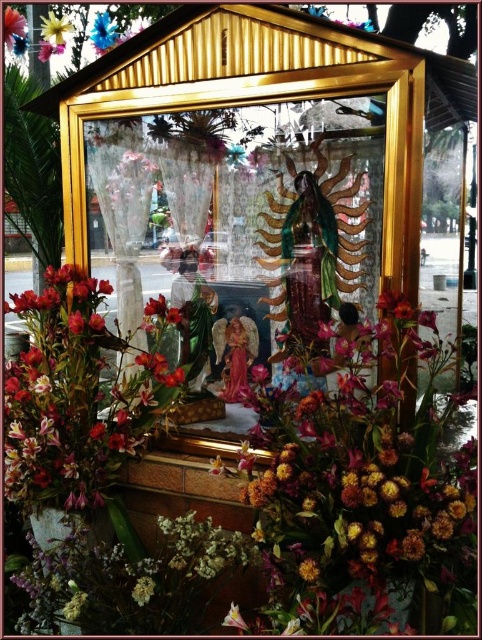
Who is lower down, yellow fabric flower at upper left or matte pink flower at upper left?

Positioned lower is matte pink flower at upper left.

Identify the location of yellow fabric flower at upper left. The image size is (482, 640). (54, 32).

The image size is (482, 640). In order to click on yellow fabric flower at upper left in this screenshot , I will do pyautogui.click(x=54, y=32).

Is point (118, 188) in front of point (116, 35)?

Yes, point (118, 188) is in front of point (116, 35).

Who is more forward, (215, 125) or (111, 35)?

Point (215, 125)

Locate an element on the screen. The image size is (482, 640). gold/glass statue at center is located at coordinates (241, 198).

You are a GUI agent. You are given a task and a screenshot of the screen. Output one action in this format:
    pyautogui.click(x=<x>, y=<y>)
    Task: Click on the gold/glass statue at center
    
    Given the screenshot: What is the action you would take?
    pyautogui.click(x=241, y=198)

Is gold/glass statue at center in front of matte pink flower at upper left?

That is True.

Can you confirm if gold/glass statue at center is positioned below matte pink flower at upper left?

Yes.

Which is behind, point (198, 173) or point (13, 24)?

The point (13, 24) is more distant.

You are a GUI agent. You are given a task and a screenshot of the screen. Output one action in this format:
    pyautogui.click(x=<x>, y=<y>)
    Task: Click on the gold/glass statue at center
    
    Given the screenshot: What is the action you would take?
    pyautogui.click(x=241, y=198)